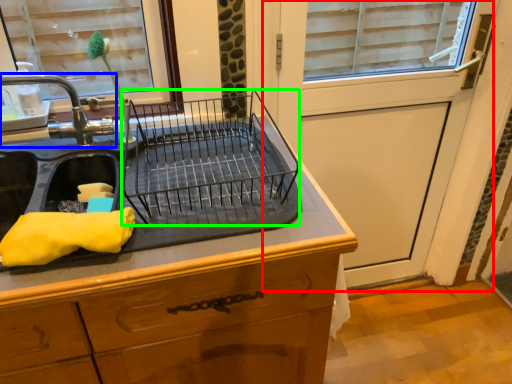
Question: Which object is the closest to the screen door (highlighted by a red box)? Choose among these: tap (highlighted by a blue box) or appliance (highlighted by a green box).

Choices:
 (A) tap
 (B) appliance

Answer: (B)